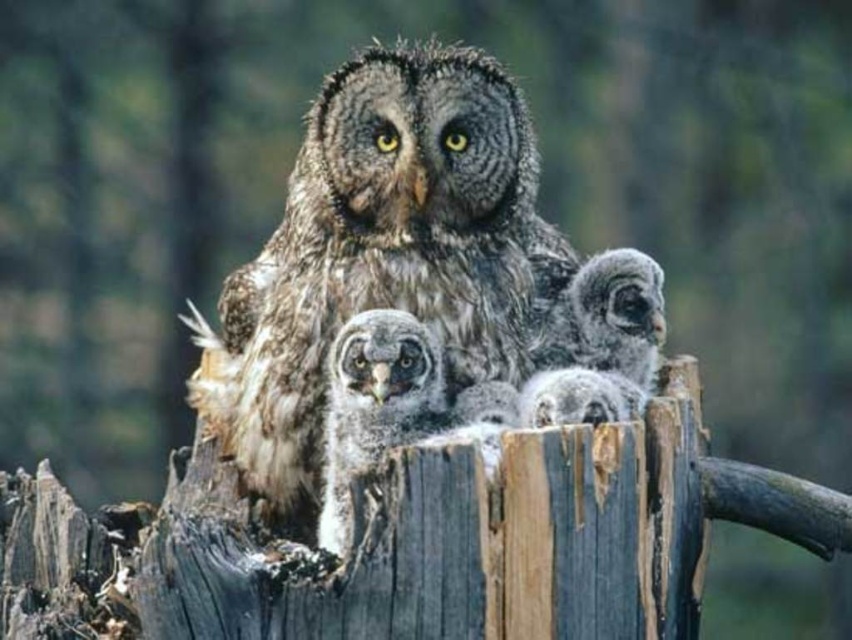
Question: Which object is closer to the camera taking this photo?

Choices:
 (A) speckled brown owl at center
 (B) speckled gray owl at center

Answer: (B)

Question: Which object is the farthest from the speckled brown owl at right?

Choices:
 (A) speckled gray owl at center
 (B) speckled brown owl at center

Answer: (A)

Question: Does speckled gray owl at center have a lesser width compared to speckled brown owl at right?

Choices:
 (A) yes
 (B) no

Answer: (A)

Question: Based on their relative distances, which object is nearer to the speckled brown owl at right?

Choices:
 (A) speckled brown owl at center
 (B) speckled gray owl at center

Answer: (A)

Question: Is speckled gray owl at center positioned in front of speckled brown owl at right?

Choices:
 (A) no
 (B) yes

Answer: (B)

Question: Is speckled gray owl at center to the right of speckled brown owl at right from the viewer's perspective?

Choices:
 (A) no
 (B) yes

Answer: (A)